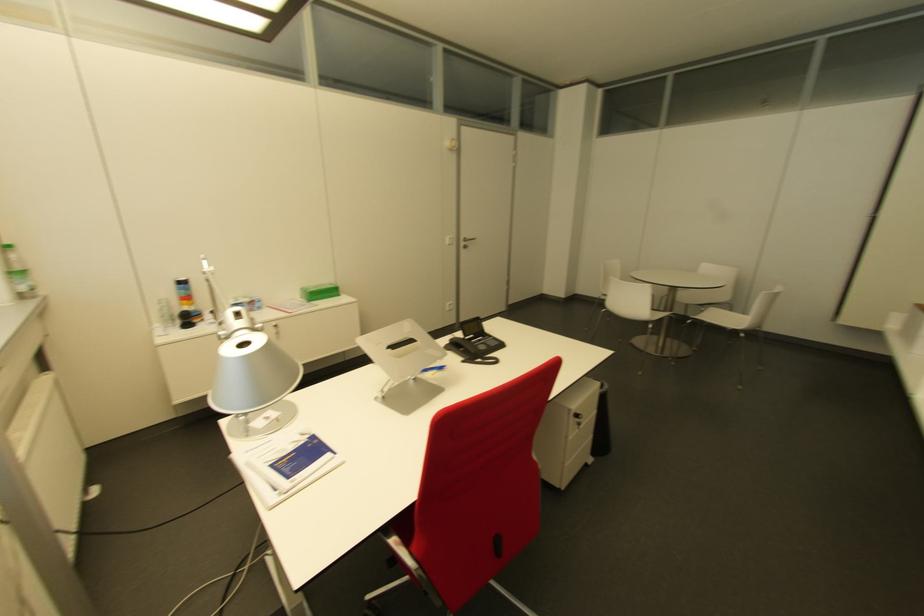
The height and width of the screenshot is (616, 924). In order to click on phone keypad buttons in this screenshot , I will do `click(490, 344)`.